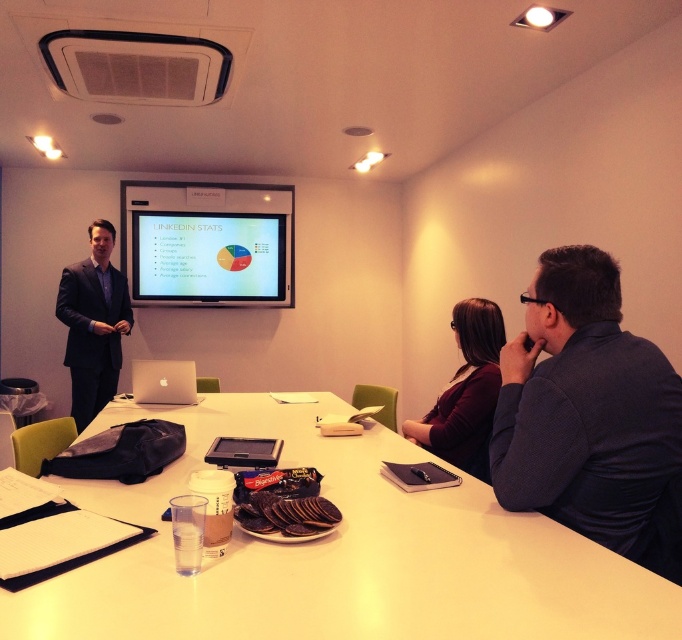
Who is higher up, maroon fabric jacket at center or silver metallic laptop at center?

maroon fabric jacket at center is above.

Can you confirm if maroon fabric jacket at center is bigger than silver metallic laptop at center?

Correct, maroon fabric jacket at center is larger in size than silver metallic laptop at center.

Is point (458, 458) positioned after point (179, 394)?

No, (458, 458) is closer to viewer.

Where is `maroon fabric jacket at center`? Image resolution: width=682 pixels, height=640 pixels. maroon fabric jacket at center is located at coordinates (466, 392).

Can you confirm if white glossy table at center is positioned below silver metallic laptop at center?

Correct, white glossy table at center is located below silver metallic laptop at center.

Which is behind, point (349, 490) or point (133, 378)?

The point (133, 378) is more distant.

Locate an element on the screen. This screenshot has width=682, height=640. white glossy table at center is located at coordinates coord(341,554).

Looking at this image, does white glossy table at center have a smaller size compared to dark blue suit at left?

Yes, white glossy table at center is smaller than dark blue suit at left.

How far apart are white glossy table at center and dark blue suit at left?

white glossy table at center is 1.99 meters away from dark blue suit at left.

What are the coordinates of `white glossy table at center` in the screenshot? It's located at [341, 554].

At what (x,y) coordinates should I click in order to perform the action: click on white glossy table at center. Please return your answer as a coordinate pair (x, y). The height and width of the screenshot is (640, 682). Looking at the image, I should click on (341, 554).